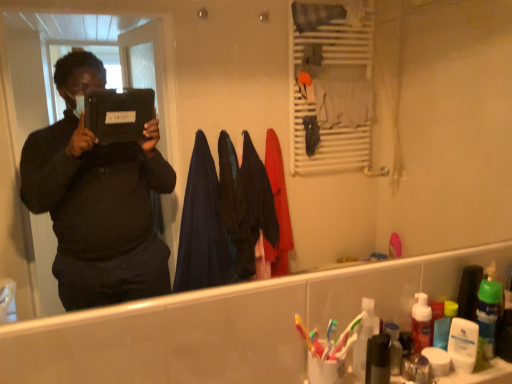
Question: Considering the relative sizes of translucent plastic toothbrushes at lower right, which is the first toiletry from left to right, and white matte lotion at lower right, which is the first toiletry in right-to-left order, in the image provided, is translucent plastic toothbrushes at lower right, which is the first toiletry from left to right, thinner than white matte lotion at lower right, which is the first toiletry in right-to-left order,?

Choices:
 (A) yes
 (B) no

Answer: (B)

Question: From the image's perspective, is translucent plastic toothbrushes at lower right, which is the first toiletry from left to right, under white matte lotion at lower right, arranged as the third toiletry when viewed from the left?

Choices:
 (A) yes
 (B) no

Answer: (B)

Question: From a real-world perspective, is translucent plastic toothbrushes at lower right, which is the first toiletry from left to right, under white matte lotion at lower right, which is the first toiletry in right-to-left order?

Choices:
 (A) yes
 (B) no

Answer: (B)

Question: Considering the relative positions of translucent plastic toothbrushes at lower right, which is the first toiletry from left to right, and white matte lotion at lower right, which is the first toiletry in right-to-left order, in the image provided, is translucent plastic toothbrushes at lower right, which is the first toiletry from left to right, behind white matte lotion at lower right, which is the first toiletry in right-to-left order,?

Choices:
 (A) yes
 (B) no

Answer: (B)

Question: Does translucent plastic toothbrushes at lower right, arranged as the 3th toiletry when viewed from the right, have a greater height compared to white matte lotion at lower right, arranged as the third toiletry when viewed from the left?

Choices:
 (A) no
 (B) yes

Answer: (B)

Question: From a real-world perspective, is multicolored plastic toothbrush at lower right physically located above or below white matte lotion at lower right, which is the first toiletry in right-to-left order?

Choices:
 (A) above
 (B) below

Answer: (A)

Question: Does point (307, 344) appear closer or farther from the camera than point (457, 364)?

Choices:
 (A) closer
 (B) farther

Answer: (A)

Question: Considering their positions, is multicolored plastic toothbrush at lower right located in front of or behind white matte lotion at lower right, arranged as the third toiletry when viewed from the left?

Choices:
 (A) behind
 (B) front

Answer: (B)

Question: From their relative heights in the image, would you say multicolored plastic toothbrush at lower right is taller or shorter than white matte lotion at lower right, arranged as the third toiletry when viewed from the left?

Choices:
 (A) short
 (B) tall

Answer: (A)

Question: From a real-world perspective, is translucent plastic toothbrushes at lower right, arranged as the 3th toiletry when viewed from the right, positioned above or below multicolored plastic toothbrush at lower right?

Choices:
 (A) above
 (B) below

Answer: (B)

Question: From the image's perspective, is translucent plastic toothbrushes at lower right, arranged as the 3th toiletry when viewed from the right, above or below multicolored plastic toothbrush at lower right?

Choices:
 (A) below
 (B) above

Answer: (A)

Question: Based on their positions, is translucent plastic toothbrushes at lower right, arranged as the 3th toiletry when viewed from the right, located to the left or right of multicolored plastic toothbrush at lower right?

Choices:
 (A) left
 (B) right

Answer: (B)

Question: Would you say translucent plastic toothbrushes at lower right, arranged as the 3th toiletry when viewed from the right, is inside or outside multicolored plastic toothbrush at lower right?

Choices:
 (A) outside
 (B) inside

Answer: (A)

Question: Is translucent plastic toothbrushes at lower right, arranged as the 3th toiletry when viewed from the right, inside or outside of metallic silver soap dispenser at lower right, which is counted as the 2th toiletry, starting from the left?

Choices:
 (A) inside
 (B) outside

Answer: (B)

Question: From a real-world perspective, is translucent plastic toothbrushes at lower right, arranged as the 3th toiletry when viewed from the right, positioned above or below metallic silver soap dispenser at lower right, positioned as the second toiletry in right-to-left order?

Choices:
 (A) below
 (B) above

Answer: (B)